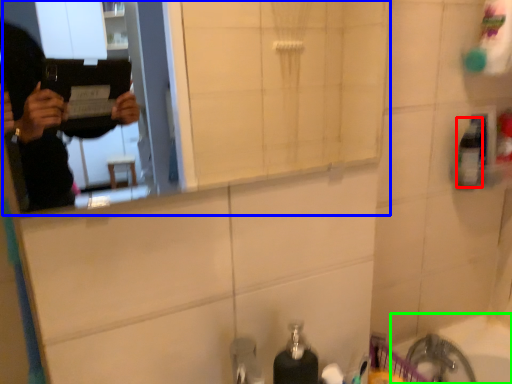
Question: Which object is the closest to the mouthwash (highlighted by a red box)? Choose among these: mirror (highlighted by a blue box) or bath (highlighted by a green box).

Choices:
 (A) mirror
 (B) bath

Answer: (B)